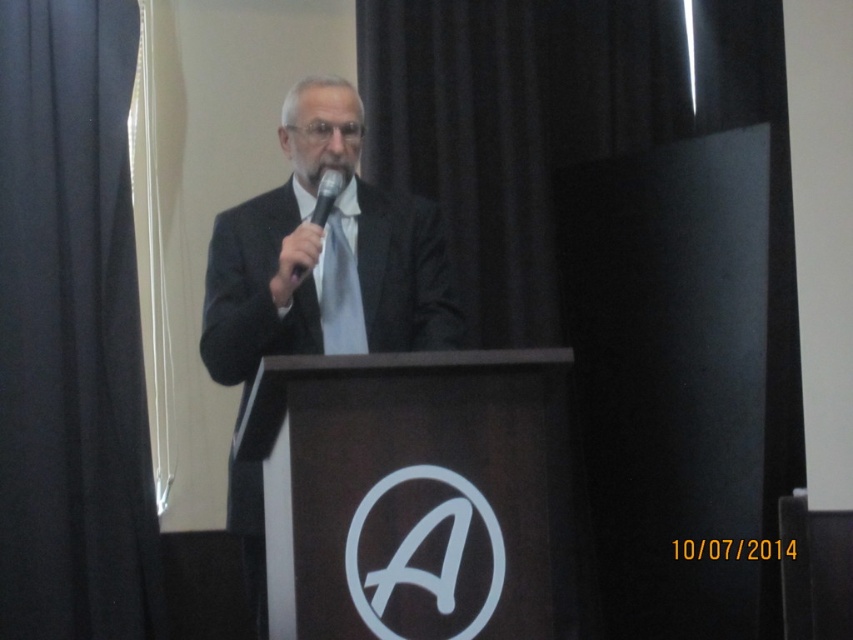
You are an event planner setting up a stage for a presentation. You need to ensure that the black matte curtain at upper left and the black matte microphone at center are positioned correctly. Based on the scene description, which object is taller?

The black matte curtain at upper left is taller than the black matte microphone at center.

You are a stagehand who needs to adjust the microphone stand so that the black matte microphone at center is exactly 6 feet away from the black matte curtain at upper left. Currently, they are 5.20 feet apart. How much farther should you move the microphone stand away from the curtain?

The black matte microphone at center needs to be moved 0.80 feet farther away from the black matte curtain at upper left to achieve the desired 6 feet distance.